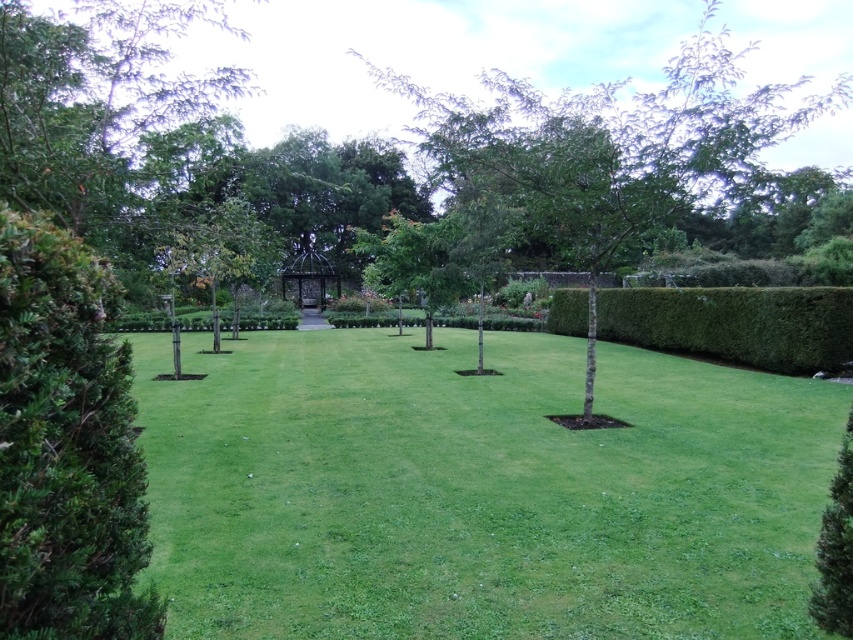
Question: Can you confirm if green leafy hedge at right is thinner than metallic gazebo at center?

Choices:
 (A) no
 (B) yes

Answer: (A)

Question: Is green leafy bush at left wider than green leafy hedge at right?

Choices:
 (A) no
 (B) yes

Answer: (A)

Question: Which object appears closest to the camera in this image?

Choices:
 (A) green grass at center
 (B) green leafy tree at center
 (C) green leafy hedge at right

Answer: (A)

Question: Which of the following is the farthest from the observer?

Choices:
 (A) (677, 83)
 (B) (303, 305)

Answer: (B)

Question: Is green grass at center to the right of metallic gazebo at center from the viewer's perspective?

Choices:
 (A) no
 (B) yes

Answer: (B)

Question: Which of the following is the closest to the observer?

Choices:
 (A) green grass at center
 (B) green leafy hedge at right
 (C) green leafy tree at center

Answer: (A)